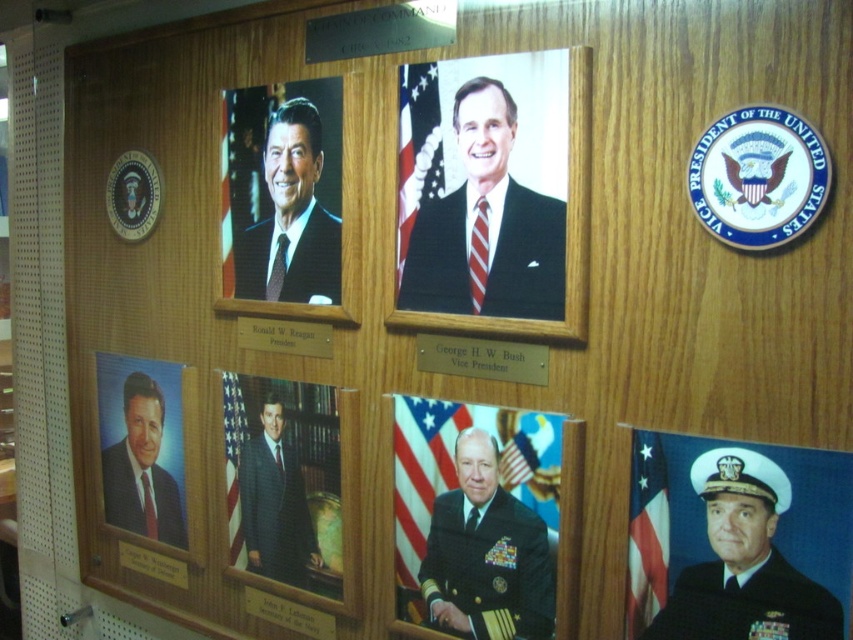
You are a tailor measuring garments for alterations. You have two items to assess in the image described. The shiny black uniform at center and the matte black suit at upper left. Which garment has a greater width measurement?

The shiny black uniform at center has a greater width than the matte black suit at upper left according to the description provided.

What is the color and type of the clothing item located at the coordinates point (483, 513)?

The shiny black uniform at center is located at point (483, 513).

You are an observer standing in front of the wooden panel. You notice two navy blue items on the panel. Which one is taller, the navy blue uniform at lower right or the navy blue fabric at center?

The navy blue uniform at lower right is taller than the navy blue fabric at center according to the description.